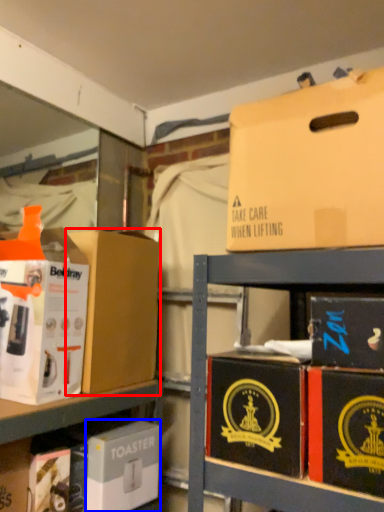
Question: Which point is further to the camera, box (highlighted by a red box) or box (highlighted by a blue box)?

Choices:
 (A) box
 (B) box

Answer: (A)